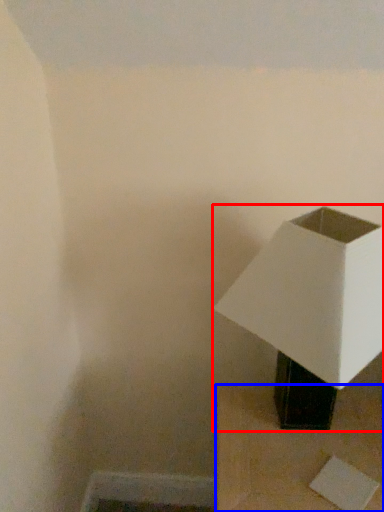
Question: Among these objects, which one is farthest to the camera, lamp (highlighted by a red box) or furniture (highlighted by a blue box)?

Choices:
 (A) lamp
 (B) furniture

Answer: (B)